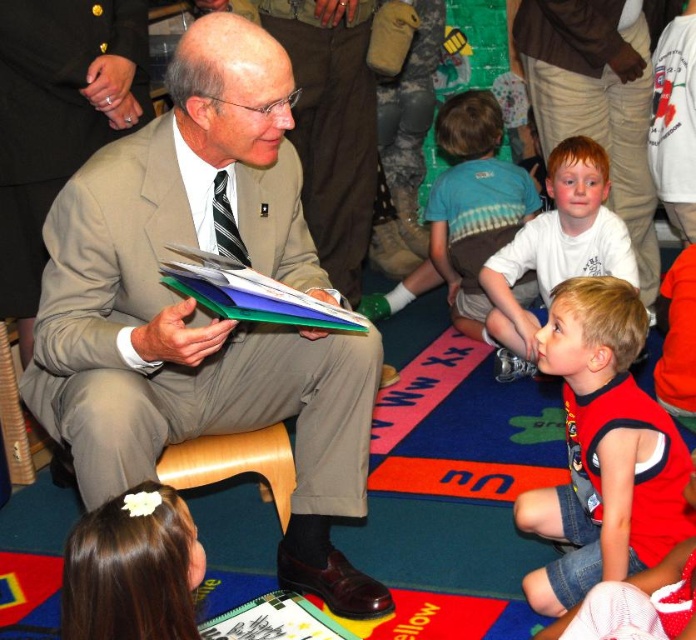
You are a photographer standing in the back of the room. You want to take a photo of the multicolored paper stack at center without the blue striped shirt at center blocking it. Is this possible based on their heights?

The blue striped shirt at center is taller than multicolored paper stack at center, so the blue striped shirt at center will block the view of the multicolored paper stack at center. You cannot take a clear photo of the multicolored paper stack at center without the blue striped shirt at center blocking it.

You are a photographer taking a picture of the beige fabric suit at upper left and the white matte shirt at center. Which one should you focus on first if you want the one closer to the camera to be sharp?

The beige fabric suit at upper left is in front of the white matte shirt at center, so you should focus on the beige fabric suit at upper left first to ensure it is sharp.

You are a photographer trying to capture the scene of the man reading to the children. You notice the blue striped shirt at center and the multicolored paper stack at center. Which object should you focus on first if you want to ensure both are in the frame?

The blue striped shirt at center is above the multicolored paper stack at center, so focusing on the blue striped shirt at center first would ensure both are in the frame since it is positioned higher up.